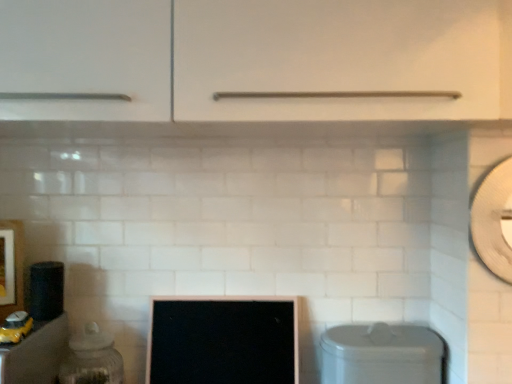
Question: Is black glossy computer monitor at center inside or outside of wooden framed picture at left?

Choices:
 (A) inside
 (B) outside

Answer: (B)

Question: Is black glossy computer monitor at center in front of or behind wooden framed picture at left in the image?

Choices:
 (A) front
 (B) behind

Answer: (B)

Question: Which is nearer to the matte black cabinet at lower left, acting as the first cabinetry starting from the bottom?

Choices:
 (A) matte black speaker at left, the second appliance viewed from the right
 (B) black glossy computer monitor at center
 (C) white matte cabinet handle at center, the 2th cabinetry from the back
 (D) satin silver dishwasher at lower center
 (E) clear glass jar at left, acting as the first appliance starting from the right

Answer: (A)

Question: Which object is the closest to the satin silver dishwasher at lower center?

Choices:
 (A) matte black cabinet at lower left, placed as the second cabinetry when sorted from right to left
 (B) black glossy computer monitor at center
 (C) wooden framed picture at left
 (D) matte black speaker at left, the second appliance viewed from the right
 (E) white matte cabinet handle at center, the 2th cabinetry from the back

Answer: (B)